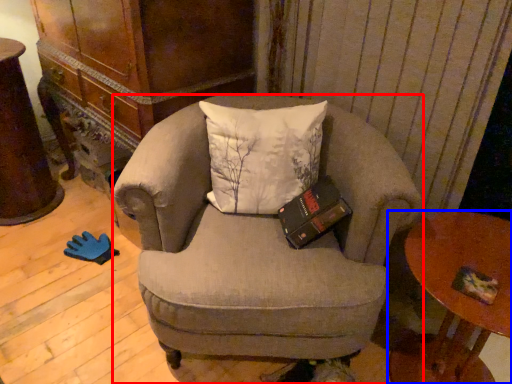
Question: Which object is further to the camera taking this photo, chair (highlighted by a red box) or table (highlighted by a blue box)?

Choices:
 (A) chair
 (B) table

Answer: (A)